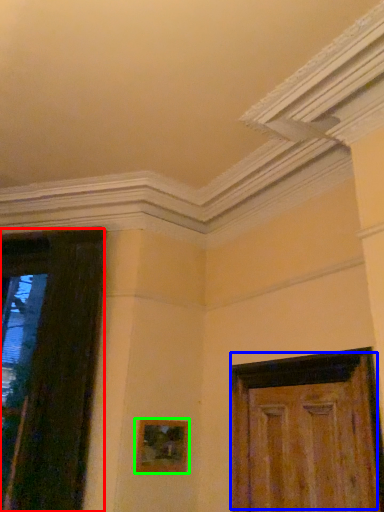
Question: Based on their relative distances, which object is farther from door (highlighted by a red box)? Choose from door (highlighted by a blue box) and picture frame (highlighted by a green box).

Choices:
 (A) door
 (B) picture frame

Answer: (A)